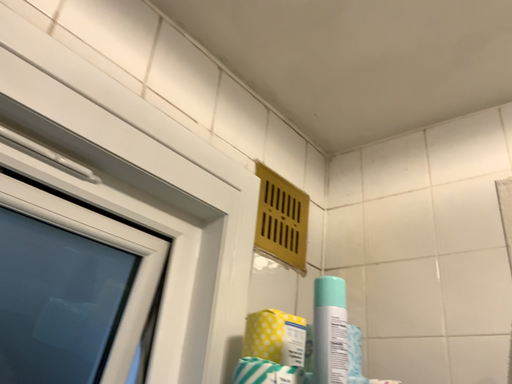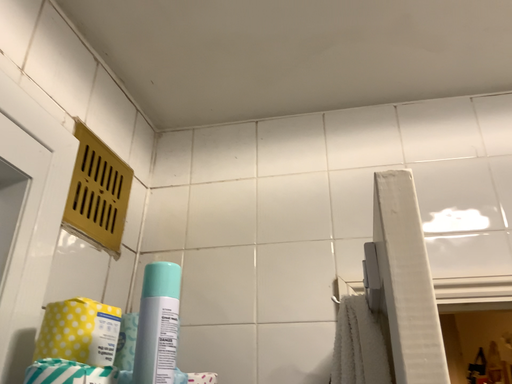
Question: Which way did the camera rotate in the video?

Choices:
 (A) rotated left
 (B) rotated right

Answer: (B)